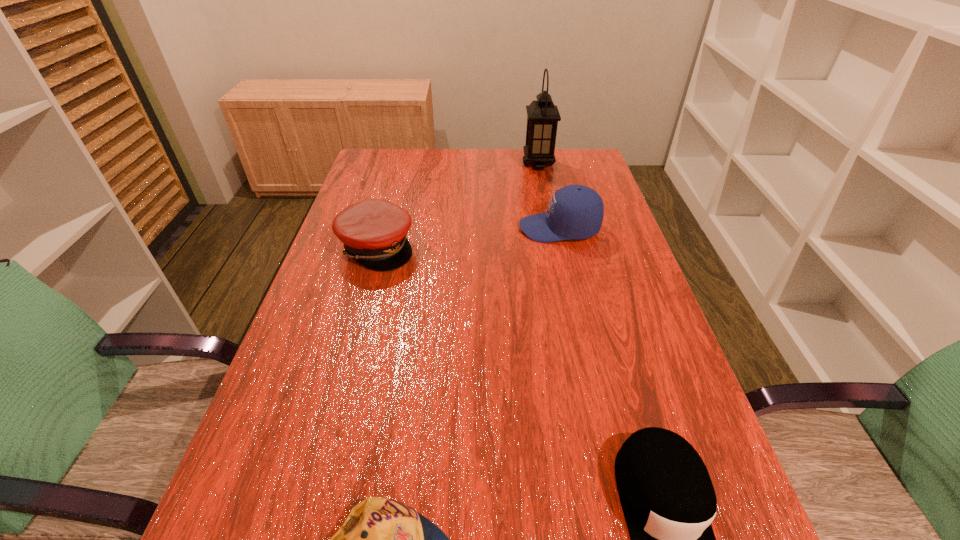
Point out which object is positioned as the second nearest to the shortest object. Please provide its 2D coordinates. Your answer should be formatted as a tuple, i.e. [(x, y)], where the tuple contains the x and y coordinates of a point satisfying the conditions above.

[(373, 231)]

Identify which cap is the second closest to the tallest cap. Please provide its 2D coordinates. Your answer should be formatted as a tuple, i.e. [(x, y)], where the tuple contains the x and y coordinates of a point satisfying the conditions above.

[(668, 500)]

I want to click on the second closest cap to the tallest cap, so click(x=668, y=500).